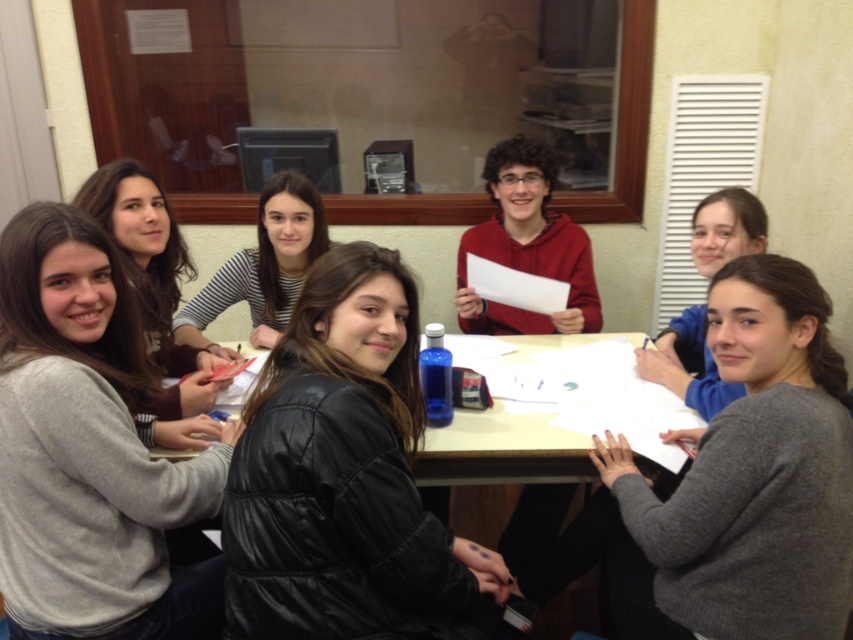
Question: Among these objects, which one is farthest from the camera?

Choices:
 (A) striped fabric shirt at center
 (B) smooth wooden table at center
 (C) black leather jacket at center
 (D) matte red hoodie at center

Answer: (D)

Question: Does striped fabric shirt at center appear on the left side of smooth wooden table at center?

Choices:
 (A) yes
 (B) no

Answer: (A)

Question: Among these objects, which one is nearest to the camera?

Choices:
 (A) striped fabric shirt at center
 (B) smooth wooden table at center
 (C) gray matte sweater at center
 (D) black leather jacket at center

Answer: (D)

Question: Does black leather jacket at center appear on the left side of smooth wooden table at center?

Choices:
 (A) no
 (B) yes

Answer: (B)

Question: Which point is farther to the camera?

Choices:
 (A) gray matte sweater at center
 (B) smooth wooden table at center
 (C) striped fabric shirt at center

Answer: (C)

Question: Does striped fabric shirt at center have a lesser width compared to gray sweater at lower right?

Choices:
 (A) no
 (B) yes

Answer: (A)